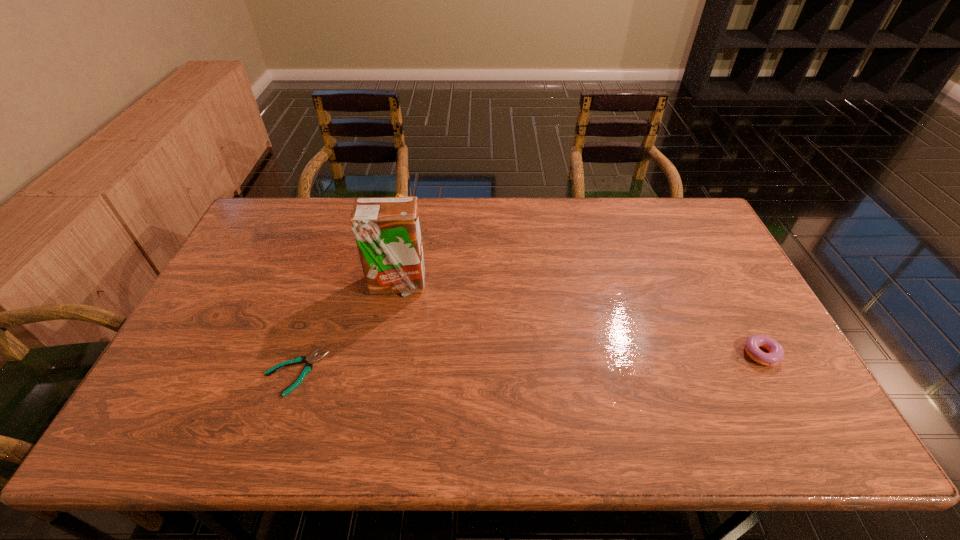
This screenshot has width=960, height=540. I want to click on free space located 0.110m on the front-facing side of the farthest object, so click(x=414, y=243).

Locate an element on the screen. free space located on the front-facing side of the farthest object is located at coordinates (420, 259).

The image size is (960, 540). In order to click on vacant region located 0.150m on the front-facing side of the farthest object in this screenshot , I will do `click(418, 251)`.

Identify the location of free space located on the straw side of the third nearest object. (427, 303).

You are a GUI agent. You are given a task and a screenshot of the screen. Output one action in this format:
    pyautogui.click(x=<x>, y=<y>)
    Task: Click on the vacant space situated on the straw side of the third nearest object
    Image resolution: width=960 pixels, height=540 pixels.
    Given the screenshot: What is the action you would take?
    pyautogui.click(x=462, y=333)

You are a GUI agent. You are given a task and a screenshot of the screen. Output one action in this format:
    pyautogui.click(x=<x>, y=<y>)
    Task: Click on the vacant space located 0.340m on the straw side of the third nearest object
    The width and height of the screenshot is (960, 540).
    Given the screenshot: What is the action you would take?
    pyautogui.click(x=499, y=364)

Find the location of `object located in the far edge section of the desktop`. object located in the far edge section of the desktop is located at coordinates (398, 195).

Find the location of a particular element. This screenshot has width=960, height=540. pliers present at the near edge is located at coordinates (308, 367).

Locate an element on the screen. Image resolution: width=960 pixels, height=540 pixels. doughnut present at the near edge is located at coordinates (776, 352).

Identify the location of object located at the right edge. This screenshot has height=540, width=960. (776, 352).